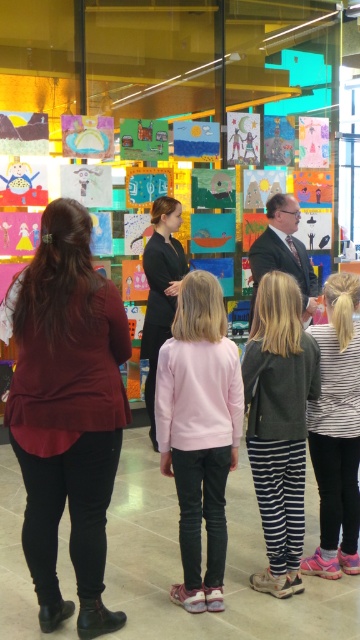
Is point (288, 384) in front of point (285, 216)?

Yes.

Who is lower down, dark gray leather jacket at center or dark suit at center?

Positioned lower is dark gray leather jacket at center.

Who is more distant from viewer, (249,458) or (280,244)?

The point (280,244) is more distant.

This screenshot has height=640, width=360. What are the coordinates of `dark gray leather jacket at center` in the screenshot? It's located at (279, 426).

Is point (295, 378) farther from viewer compared to point (344, 470)?

No, it is in front of (344, 470).

Between dark gray leather jacket at center and white striped shirt at right, which one appears on the right side from the viewer's perspective?

From the viewer's perspective, white striped shirt at right appears more on the right side.

Which is in front, point (290, 545) or point (309, 426)?

Point (290, 545)

This screenshot has height=640, width=360. What are the coordinates of `dark gray leather jacket at center` in the screenshot? It's located at (279, 426).

Who is positioned more to the right, matte burgundy blouse at center or black matte dress at center?

From the viewer's perspective, black matte dress at center appears more on the right side.

Does point (24, 330) come closer to viewer compared to point (149, 376)?

Yes, it is in front of point (149, 376).

Between point (48, 298) and point (146, 276), which one is positioned behind?

Point (146, 276)

Identify the location of matte burgundy blouse at center. (66, 410).